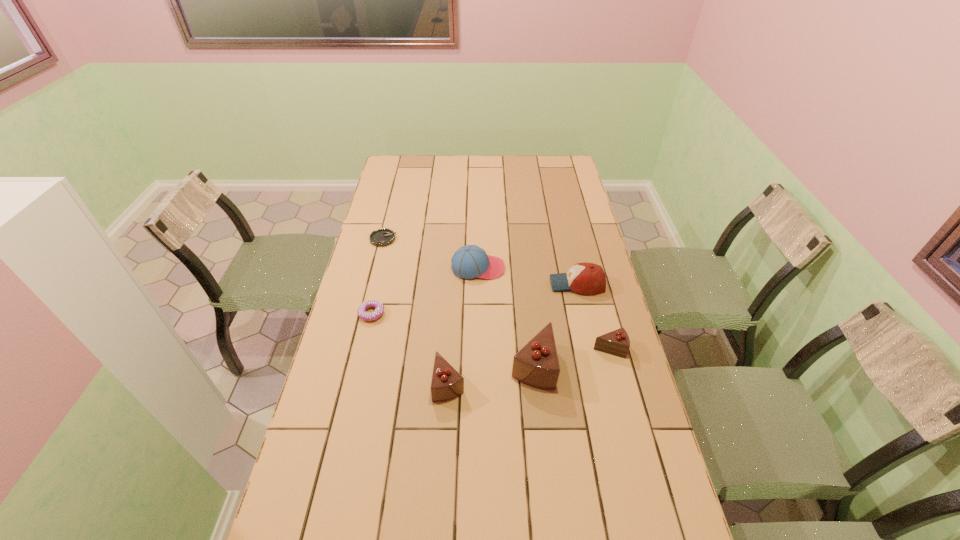
You are a GUI agent. You are given a task and a screenshot of the screen. Output one action in this format:
    pyautogui.click(x=<x>, y=<y>)
    Task: Click on the empty space that is in between the ashtray and the shortest chocolate cake
    
    Given the screenshot: What is the action you would take?
    pyautogui.click(x=496, y=294)

Where is `vacant space that's between the shortest object and the rightmost chocolate cake`? The width and height of the screenshot is (960, 540). vacant space that's between the shortest object and the rightmost chocolate cake is located at coordinates (496, 294).

Where is `empty space that is in between the fourth nearest object and the leftmost chocolate cake`? The image size is (960, 540). empty space that is in between the fourth nearest object and the leftmost chocolate cake is located at coordinates (410, 348).

Where is `vacant space that's between the third object from right to left and the sixth tallest object`? The width and height of the screenshot is (960, 540). vacant space that's between the third object from right to left and the sixth tallest object is located at coordinates (452, 340).

Image resolution: width=960 pixels, height=540 pixels. What are the coordinates of `free space between the third shortest object and the right baseball cap` in the screenshot? It's located at (593, 316).

The width and height of the screenshot is (960, 540). What are the coordinates of `free point between the doughnut and the second tallest chocolate cake` in the screenshot? It's located at (410, 348).

Image resolution: width=960 pixels, height=540 pixels. I want to click on free point between the second shortest object and the right baseball cap, so click(x=474, y=299).

Where is `free space between the shortest chocolate cake and the doughnut`? The height and width of the screenshot is (540, 960). free space between the shortest chocolate cake and the doughnut is located at coordinates (491, 331).

Choose which object is the third nearest neighbor to the sixth tallest object. Please provide its 2D coordinates. Your answer should be formatted as a tuple, i.e. [(x, y)], where the tuple contains the x and y coordinates of a point satisfying the conditions above.

[(382, 237)]

Point out which object is positioned as the fourth nearest to the ashtray. Please provide its 2D coordinates. Your answer should be formatted as a tuple, i.e. [(x, y)], where the tuple contains the x and y coordinates of a point satisfying the conditions above.

[(585, 278)]